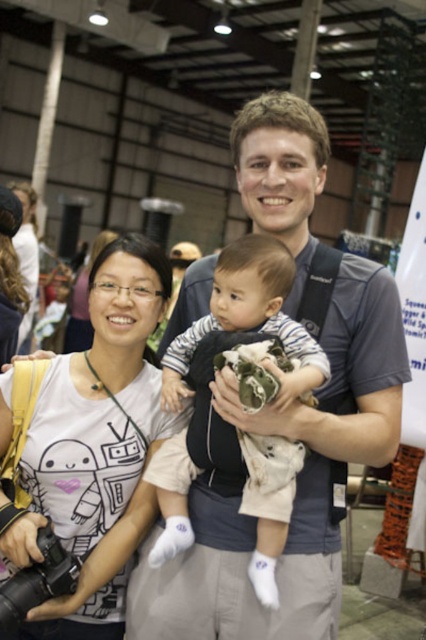
Question: Can you confirm if matte gray shirt at center is positioned to the left of white cotton baby at center?

Choices:
 (A) yes
 (B) no

Answer: (B)

Question: Can you confirm if matte gray shirt at center is smaller than white matte t-shirt at center?

Choices:
 (A) yes
 (B) no

Answer: (B)

Question: Does matte gray shirt at center have a smaller size compared to white cotton baby at center?

Choices:
 (A) yes
 (B) no

Answer: (B)

Question: Among these points, which one is farthest from the camera?

Choices:
 (A) (80, 460)
 (B) (14, 582)

Answer: (A)

Question: Among these objects, which one is farthest from the camera?

Choices:
 (A) white matte t-shirt at center
 (B) black plastic camera at lower left
 (C) white cotton baby at center
 (D) matte gray shirt at center

Answer: (A)

Question: Among these objects, which one is farthest from the camera?

Choices:
 (A) black plastic camera at lower left
 (B) white cotton baby at center
 (C) matte gray shirt at center
 (D) white matte t-shirt at center

Answer: (D)